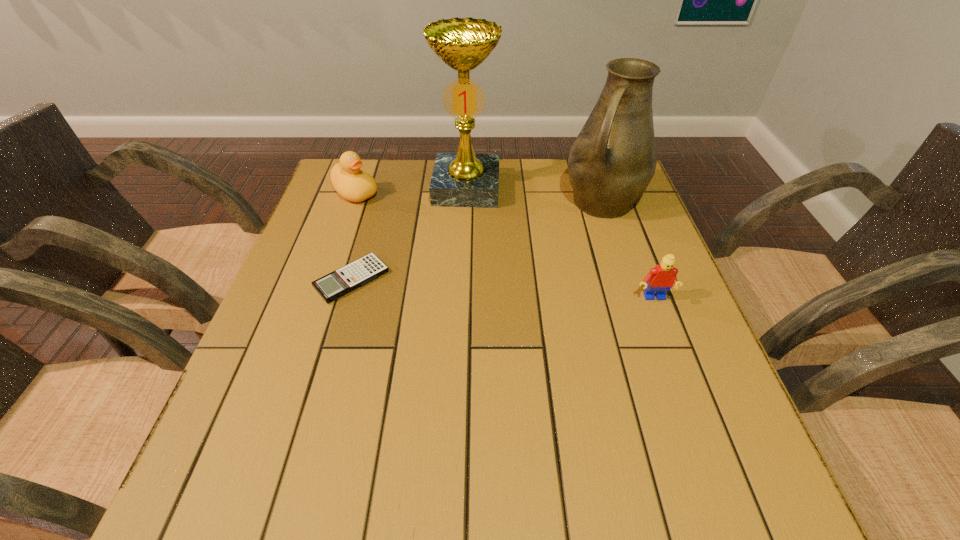
Identify the location of vacant space located on the face of the duck. (469, 270).

The height and width of the screenshot is (540, 960). Identify the location of free space located 0.050m on the face of the duck. (381, 210).

You are a GUI agent. You are given a task and a screenshot of the screen. Output one action in this format:
    pyautogui.click(x=<x>, y=<y>)
    Task: Click on the free space located 0.400m on the face of the duck
    
    Given the screenshot: What is the action you would take?
    pyautogui.click(x=472, y=272)

Where is `vacant space located on the handle side of the fourth shortest object`? vacant space located on the handle side of the fourth shortest object is located at coordinates (576, 246).

In order to click on free space located on the handle side of the fourth shortest object in this screenshot , I will do `click(563, 268)`.

Find the location of a particular element. The width and height of the screenshot is (960, 540). vacant space located 0.070m on the handle side of the fourth shortest object is located at coordinates (580, 241).

The width and height of the screenshot is (960, 540). Find the location of `award that is at the far edge`. award that is at the far edge is located at coordinates (464, 179).

Locate an element on the screen. The width and height of the screenshot is (960, 540). duck positioned at the far edge is located at coordinates (353, 184).

Locate an element on the screen. The width and height of the screenshot is (960, 540). pitcher located at the far edge is located at coordinates coord(613,159).

Find the location of a particular element. The width and height of the screenshot is (960, 540). calculator present at the left edge is located at coordinates (338, 283).